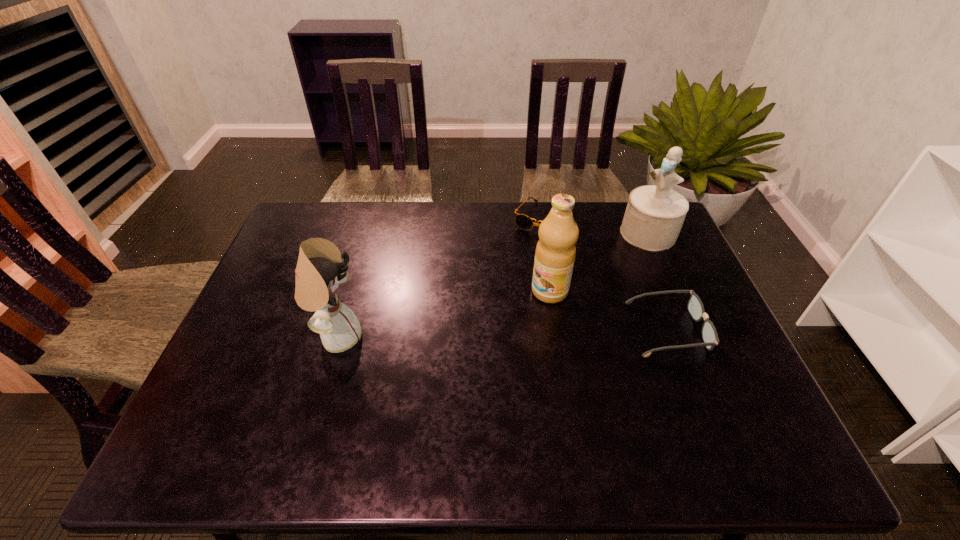
Where is `vacant space located 0.080m on the lenses of the sunglasses`? This screenshot has width=960, height=540. vacant space located 0.080m on the lenses of the sunglasses is located at coordinates (525, 251).

Locate an element on the screen. The width and height of the screenshot is (960, 540). free space located 0.160m on the lenses of the sunglasses is located at coordinates (516, 267).

Where is `free region located 0.140m on the lenses of the sunglasses`? The image size is (960, 540). free region located 0.140m on the lenses of the sunglasses is located at coordinates (518, 263).

This screenshot has width=960, height=540. In order to click on blank space located at the beak of the figurine in this screenshot , I will do `click(588, 285)`.

The width and height of the screenshot is (960, 540). I want to click on vacant area situated 0.280m at the beak of the figurine, so click(x=583, y=291).

What are the coordinates of `blank space located 0.090m at the beak of the figurine` in the screenshot? It's located at (618, 259).

This screenshot has height=540, width=960. Find the location of `sunglasses at the far edge`. sunglasses at the far edge is located at coordinates (524, 222).

I want to click on figurine located in the far edge section of the desktop, so click(x=654, y=215).

Identify the location of spectacles that is at the right edge. (695, 306).

The height and width of the screenshot is (540, 960). What are the coordinates of `figurine that is at the right edge` in the screenshot? It's located at (654, 215).